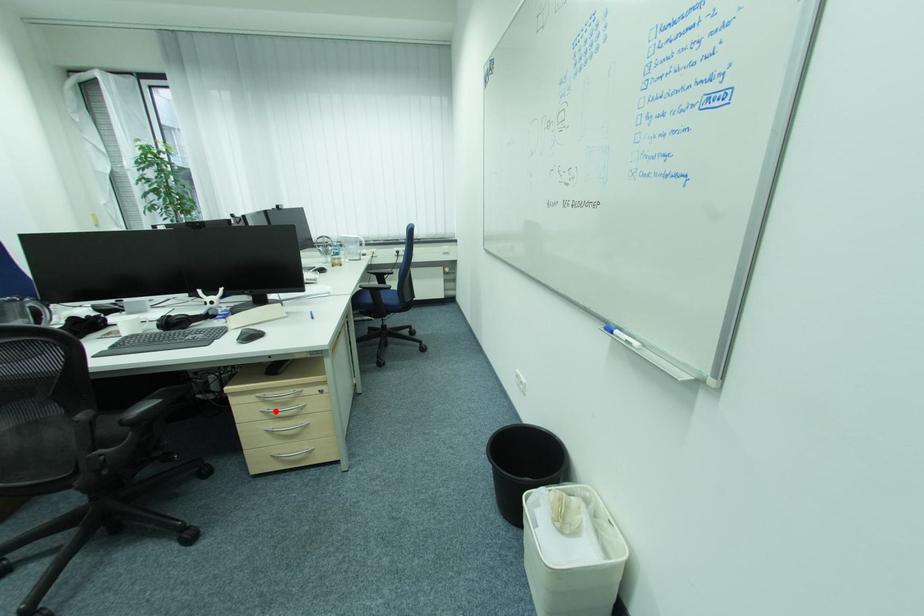
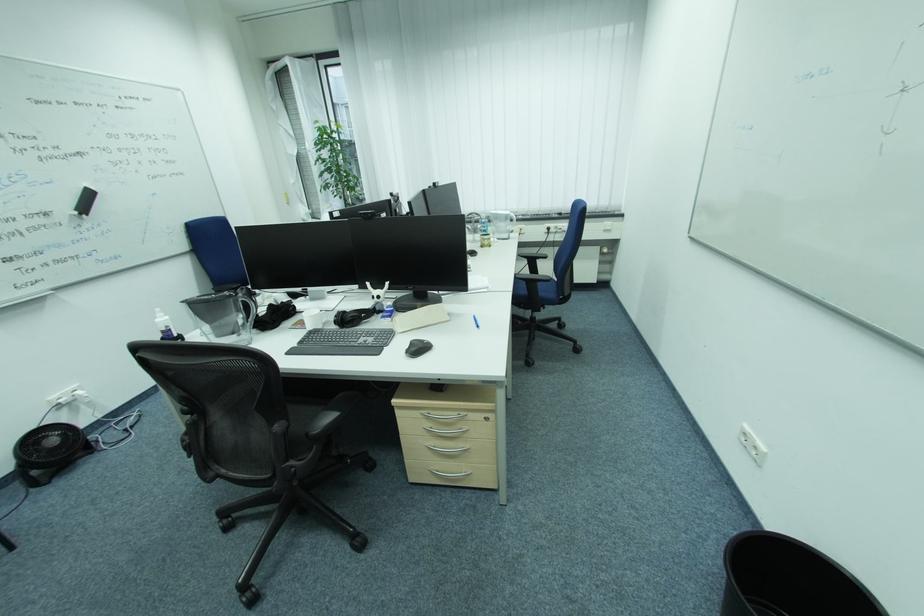
Where in the second image is the point corresponding to the highlighted location from the first image?

(438, 429)